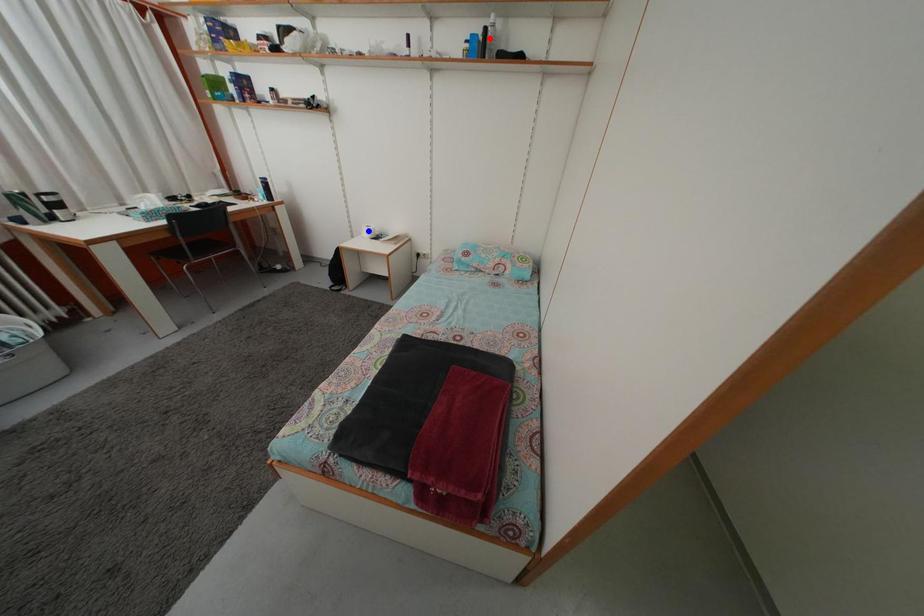
Question: In the image, two points are highlighted. Which point is nearer to the camera? Reply with the corresponding letter.

Choices:
 (A) blue point
 (B) red point

Answer: (B)